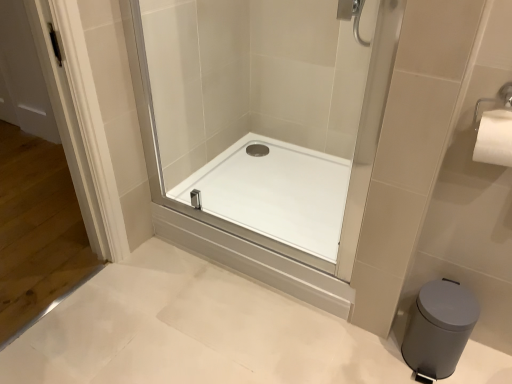
Measure the distance between point (420,329) and camera.

Point (420,329) is 4.06 feet away from camera.

What do you see at coordinates (275, 192) in the screenshot?
I see `white glossy shower tray at center` at bounding box center [275, 192].

You are a GUI agent. You are given a task and a screenshot of the screen. Output one action in this format:
    pyautogui.click(x=<x>, y=<y>)
    Task: Click on the gray matte trash can at lower right
    Image resolution: width=512 pixels, height=384 pixels.
    Given the screenshot: What is the action you would take?
    pyautogui.click(x=439, y=328)

Could you tell me if gray matte trash can at lower right is turned towards white glossy shower tray at center?

No, gray matte trash can at lower right is not turned towards white glossy shower tray at center.

Does point (418, 352) come farther from viewer compared to point (236, 168)?

No, (418, 352) is closer to viewer.

Who is smaller, gray matte trash can at lower right or white glossy shower tray at center?

With smaller size is gray matte trash can at lower right.

Does transparent glass shower door at center lie behind white glossy shower tray at center?

No, it is in front of white glossy shower tray at center.

Is the surface of transparent glass shower door at center in direct contact with white glossy shower tray at center?

No, transparent glass shower door at center is not in contact with white glossy shower tray at center.

Measure the distance from transparent glass shower door at center to white glossy shower tray at center.

transparent glass shower door at center and white glossy shower tray at center are 6.69 inches apart from each other.

Is point (178, 3) less distant than point (294, 184)?

Yes, point (178, 3) is closer to viewer.

From the image's perspective, between gray matte trash can at lower right and transparent glass shower door at center, who is located below?

gray matte trash can at lower right appears lower in the image.

Could you tell me if gray matte trash can at lower right is facing transparent glass shower door at center?

No, gray matte trash can at lower right is not aimed at transparent glass shower door at center.

Which object is wider, gray matte trash can at lower right or transparent glass shower door at center?

Wider between the two is gray matte trash can at lower right.

From a real-world perspective, which object stands above the other?

In real-world perspective, transparent glass shower door at center is above.

Is transparent glass shower door at center at the right side of gray matte trash can at lower right?

No.

Looking at their sizes, would you say transparent glass shower door at center is wider or thinner than gray matte trash can at lower right?

Clearly, transparent glass shower door at center has less width compared to gray matte trash can at lower right.

Is white glossy shower tray at center positioned with its back to gray matte trash can at lower right?

No, white glossy shower tray at center is not facing away from gray matte trash can at lower right.

Considering the positions of objects white glossy shower tray at center and gray matte trash can at lower right in the image provided, who is more to the right, white glossy shower tray at center or gray matte trash can at lower right?

gray matte trash can at lower right is more to the right.

Which object is thinner, white glossy shower tray at center or gray matte trash can at lower right?

gray matte trash can at lower right.

From their relative heights in the image, would you say white glossy shower tray at center is taller or shorter than gray matte trash can at lower right?

Considering their sizes, white glossy shower tray at center has less height than gray matte trash can at lower right.

From a real-world perspective, which object rests below the other?

white glossy shower tray at center.

Considering the relative sizes of white glossy shower tray at center and transparent glass shower door at center in the image provided, is white glossy shower tray at center thinner than transparent glass shower door at center?

No.

Are white glossy shower tray at center and transparent glass shower door at center far apart?

They are positioned close to each other.

What are the coordinates of `shower door lying on the left of white glossy shower tray at center` in the screenshot? It's located at (265, 115).

Identify the location of bath lying behind the gray matte trash can at lower right. (275, 192).

Image resolution: width=512 pixels, height=384 pixels. Identify the location of shower door that is above the white glossy shower tray at center (from the image's perspective). (265, 115).

Which object lies further to the anchor point gray matte trash can at lower right, white glossy shower tray at center or transparent glass shower door at center?

transparent glass shower door at center is further to gray matte trash can at lower right.

From the image, which object appears to be farther from gray matte trash can at lower right, transparent glass shower door at center or white glossy shower tray at center?

transparent glass shower door at center.

Which object lies nearer to the anchor point transparent glass shower door at center, white glossy shower tray at center or gray matte trash can at lower right?

white glossy shower tray at center lies closer to transparent glass shower door at center than the other object.

Looking at the image, which one is located closer to white glossy shower tray at center, transparent glass shower door at center or gray matte trash can at lower right?

Based on the image, transparent glass shower door at center appears to be nearer to white glossy shower tray at center.

Looking at the image, which one is located further to transparent glass shower door at center, gray matte trash can at lower right or white glossy shower tray at center?

gray matte trash can at lower right is positioned further to the anchor transparent glass shower door at center.

Based on their spatial positions, is gray matte trash can at lower right or transparent glass shower door at center further from white glossy shower tray at center?

gray matte trash can at lower right is positioned further to the anchor white glossy shower tray at center.

Where is `bath between transparent glass shower door at center and gray matte trash can at lower right in the vertical direction`? Image resolution: width=512 pixels, height=384 pixels. bath between transparent glass shower door at center and gray matte trash can at lower right in the vertical direction is located at coordinates (275, 192).